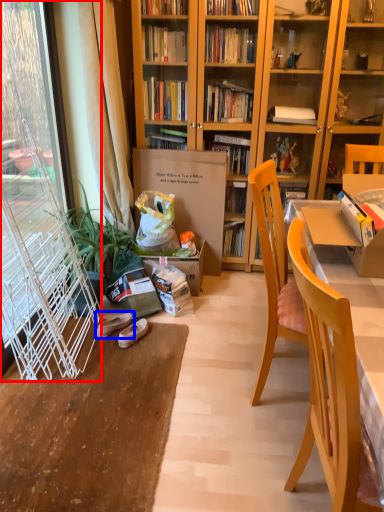
Question: Which object is closer to the camera taking this photo, screen door (highlighted by a red box) or footwear (highlighted by a blue box)?

Choices:
 (A) screen door
 (B) footwear

Answer: (A)